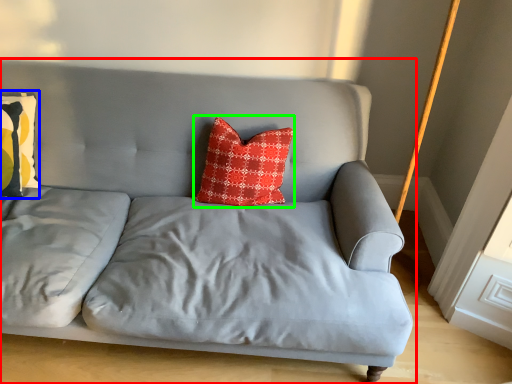
Question: Which object is positioned farthest from studio couch (highlighted by a red box)? Select from pillow (highlighted by a blue box) and pillow (highlighted by a green box).

Choices:
 (A) pillow
 (B) pillow

Answer: (A)